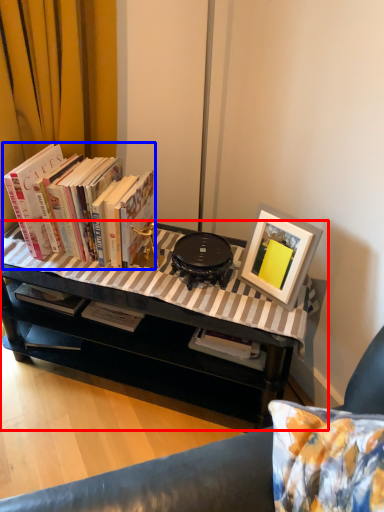
Question: Among these objects, which one is farthest to the camera, table (highlighted by a red box) or book (highlighted by a blue box)?

Choices:
 (A) table
 (B) book

Answer: (B)